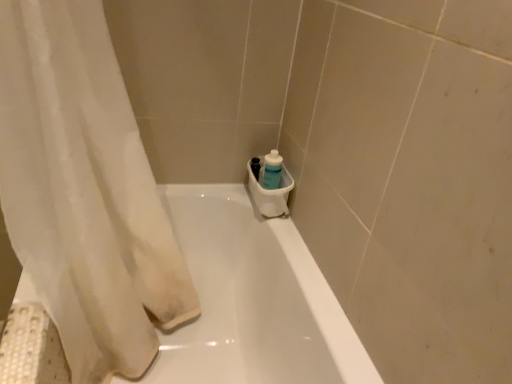
Question: Is white glossy bathtub at center in front of or behind translucent plastic bottle at lower right in the image?

Choices:
 (A) front
 (B) behind

Answer: (A)

Question: Would you say white glossy bathtub at center is to the left or to the right of translucent plastic bottle at lower right in the picture?

Choices:
 (A) right
 (B) left

Answer: (B)

Question: Considering the real-world distances, which object is farthest from the white sheer curtain at left?

Choices:
 (A) white glossy bathtub at center
 (B) translucent plastic bottle at lower right

Answer: (B)

Question: Estimate the real-world distances between objects in this image. Which object is closer to the white glossy bathtub at center?

Choices:
 (A) white sheer curtain at left
 (B) translucent plastic bottle at lower right

Answer: (A)